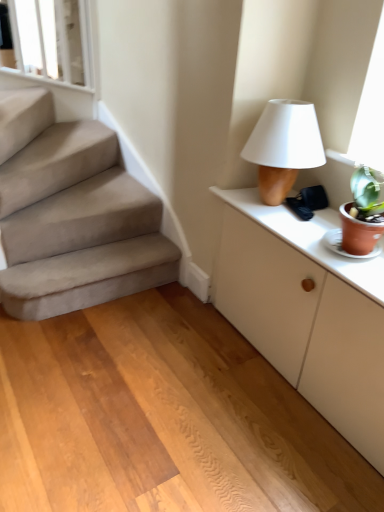
Where is `vacant space in front of matte brown table lamp at upper right`? vacant space in front of matte brown table lamp at upper right is located at coordinates (303, 230).